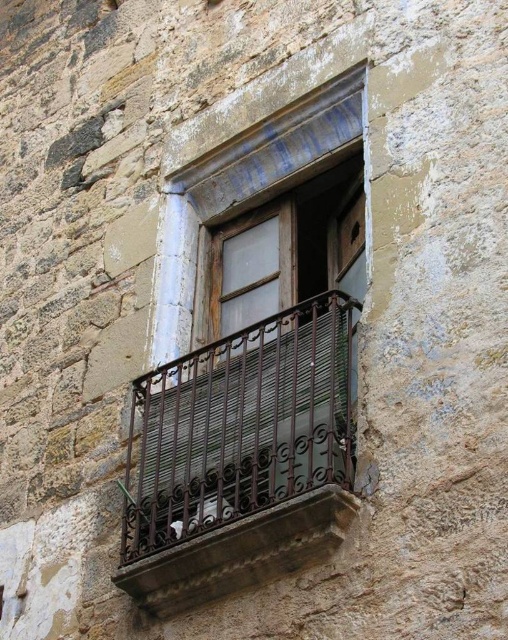
Question: Which object appears closest to the camera in this image?

Choices:
 (A) rusty metal balcony at center
 (B) brown wrought iron at center

Answer: (B)

Question: Is rusty metal balcony at center below brown wrought iron at center?

Choices:
 (A) yes
 (B) no

Answer: (B)

Question: Can you confirm if rusty metal balcony at center is wider than brown wrought iron at center?

Choices:
 (A) no
 (B) yes

Answer: (B)

Question: Is rusty metal balcony at center bigger than brown wrought iron at center?

Choices:
 (A) no
 (B) yes

Answer: (B)

Question: Which point appears farthest from the camera in this image?

Choices:
 (A) (233, 525)
 (B) (321, 492)

Answer: (A)